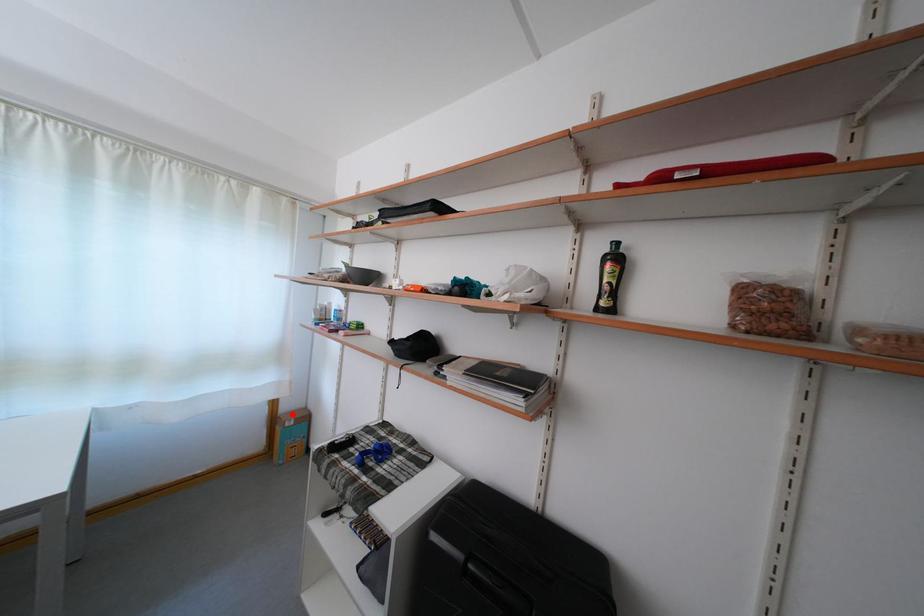
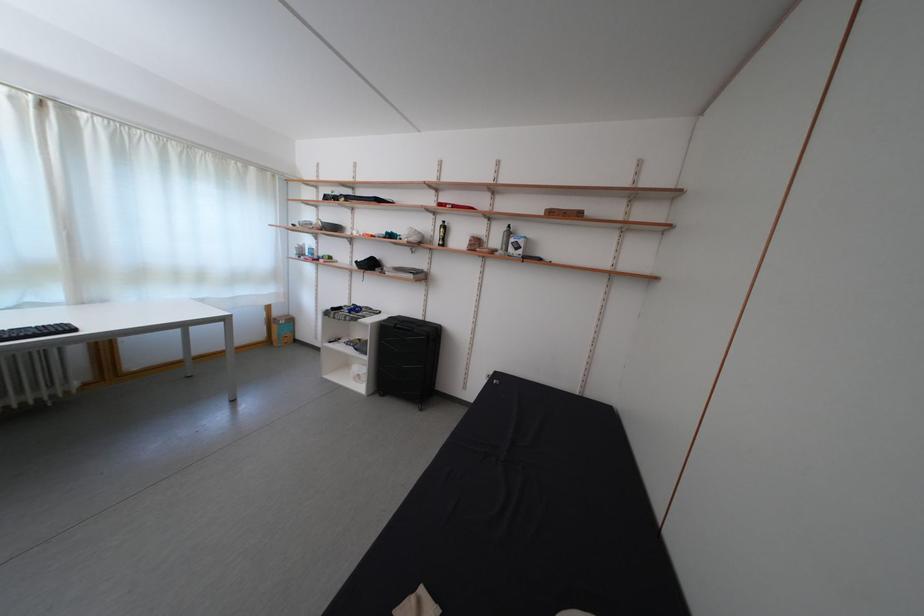
Question: I am providing you with two images of the same scene from different viewpoints. Given a red point in image1, look at the same physical point in image2. Is it:

Choices:
 (A) Closer to the viewpoint
 (B) Farther from the viewpoint

Answer: (B)